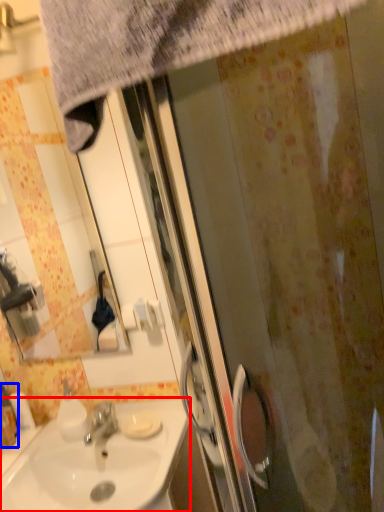
Question: Which object appears closest to the camera in this image, sink (highlighted by a red box) or bottle (highlighted by a blue box)?

Choices:
 (A) sink
 (B) bottle

Answer: (A)